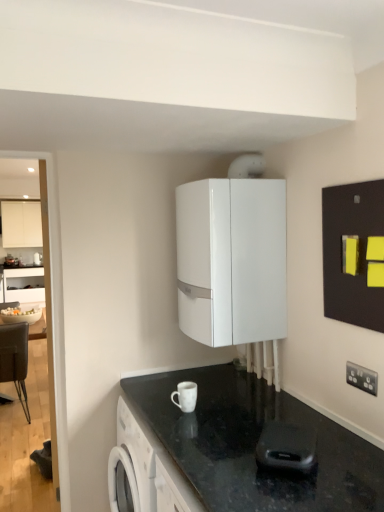
Question: Does white glossy mug at lower center, the 2th appliance viewed from the front, have a larger size compared to white glossy boiler at upper center, the 3th appliance from the bottom?

Choices:
 (A) yes
 (B) no

Answer: (B)

Question: Does white glossy mug at lower center, the second appliance when ordered from top to bottom, have a smaller size compared to white glossy boiler at upper center, the first appliance positioned from the top?

Choices:
 (A) yes
 (B) no

Answer: (A)

Question: From the image's perspective, is white glossy mug at lower center, the 2th appliance viewed from the back, located beneath white glossy boiler at upper center, the 3th appliance in the front-to-back sequence?

Choices:
 (A) no
 (B) yes

Answer: (B)

Question: Can you confirm if white glossy mug at lower center, the first appliance viewed from the left, is taller than white glossy boiler at upper center, which is counted as the second appliance, starting from the right?

Choices:
 (A) yes
 (B) no

Answer: (B)

Question: Considering the relative positions of white glossy mug at lower center, the third appliance positioned from the right, and white glossy boiler at upper center, which ranks as the 1th appliance in back-to-front order, in the image provided, is white glossy mug at lower center, the third appliance positioned from the right, to the right of white glossy boiler at upper center, which ranks as the 1th appliance in back-to-front order, from the viewer's perspective?

Choices:
 (A) no
 (B) yes

Answer: (A)

Question: Is white glossy mug at lower center, the 2th appliance viewed from the back, positioned before white glossy boiler at upper center, the 3th appliance in the front-to-back sequence?

Choices:
 (A) yes
 (B) no

Answer: (A)

Question: From the image's perspective, would you say white plastic electric outlet at lower right is positioned over white glossy boiler at center, the second cabinetry positioned from the left?

Choices:
 (A) no
 (B) yes

Answer: (A)

Question: Is white plastic electric outlet at lower right smaller than white glossy boiler at center, the second cabinetry positioned from the left?

Choices:
 (A) no
 (B) yes

Answer: (B)

Question: Is white plastic electric outlet at lower right positioned in front of white glossy boiler at center, the 1th cabinetry when ordered from front to back?

Choices:
 (A) no
 (B) yes

Answer: (B)

Question: Considering the relative sizes of white plastic electric outlet at lower right and white glossy boiler at center, arranged as the 2th cabinetry when viewed from the top, in the image provided, is white plastic electric outlet at lower right shorter than white glossy boiler at center, arranged as the 2th cabinetry when viewed from the top,?

Choices:
 (A) no
 (B) yes

Answer: (B)

Question: Is white plastic electric outlet at lower right thinner than white glossy boiler at center, which is the 1th cabinetry in bottom-to-top order?

Choices:
 (A) yes
 (B) no

Answer: (A)

Question: Would you say white plastic electric outlet at lower right is a long distance from white glossy boiler at center, the second cabinetry positioned from the left?

Choices:
 (A) yes
 (B) no

Answer: (B)

Question: Could you tell me if white plastic electric outlet at lower right is facing black rubber remote control at lower center, which ranks as the first appliance in bottom-to-top order?

Choices:
 (A) no
 (B) yes

Answer: (A)